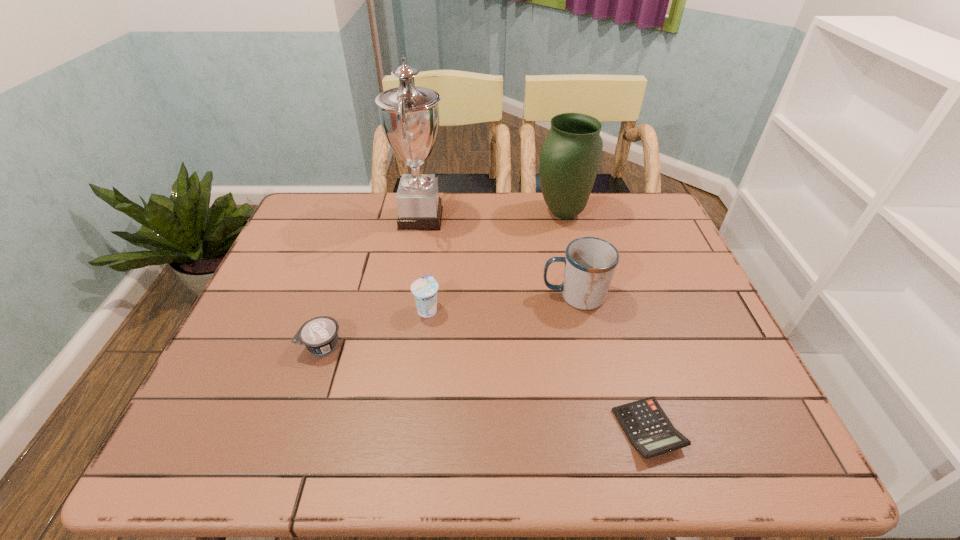
The height and width of the screenshot is (540, 960). Identify the location of free space that is in between the nearest object and the fifth tallest object. (485, 387).

Locate an element on the screen. free space between the second shortest object and the taller yogurt is located at coordinates (374, 327).

Find the location of a particular element. Image resolution: width=960 pixels, height=540 pixels. free space between the second nearest object and the shortest object is located at coordinates (485, 387).

The image size is (960, 540). Identify the location of free spot between the mug and the fifth tallest object. pos(448,321).

Where is `vacant area that lies between the second nearest object and the fourth shortest object`? vacant area that lies between the second nearest object and the fourth shortest object is located at coordinates (448, 321).

I want to click on object identified as the closest to the second tallest object, so tap(590, 262).

The height and width of the screenshot is (540, 960). Find the location of `the third closest object relative to the trophy cup`. the third closest object relative to the trophy cup is located at coordinates (590, 262).

Find the location of a particular element. The height and width of the screenshot is (540, 960). free spot that satisfies the following two spatial constraints: 1. at the front view of the trophy cup; 2. on the back side of the third shortest object is located at coordinates click(x=405, y=309).